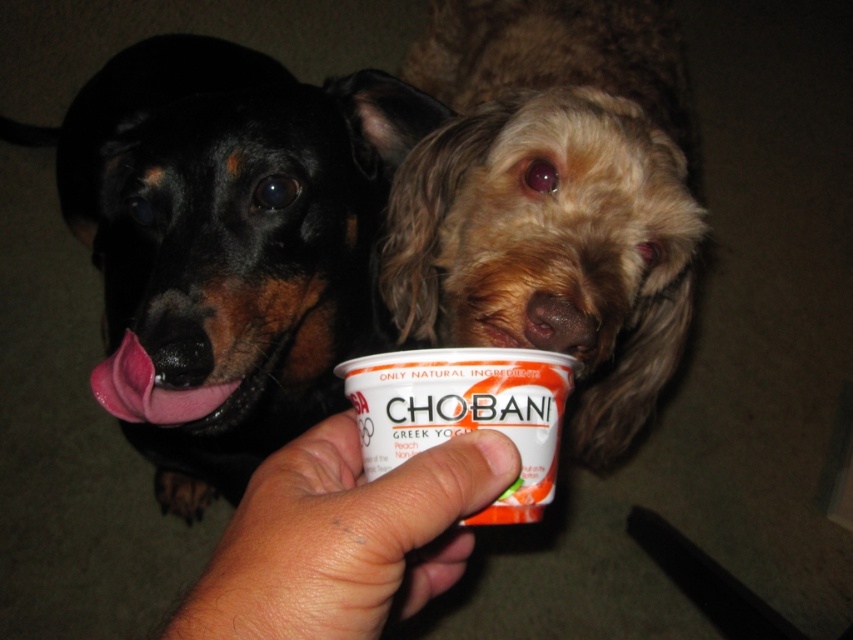
Does black glossy fur at left appear on the right side of shaggy brown fur at center?

Incorrect, black glossy fur at left is not on the right side of shaggy brown fur at center.

Is black glossy fur at left above shaggy brown fur at center?

Yes.

This screenshot has height=640, width=853. Describe the element at coordinates (227, 244) in the screenshot. I see `black glossy fur at left` at that location.

In order to click on black glossy fur at left in this screenshot , I will do `click(227, 244)`.

Is shaggy brown fur at center taller than smooth skin hand at center?

Yes.

Where is `shaggy brown fur at center`? shaggy brown fur at center is located at coordinates (552, 198).

Is black glossy fur at left wider than smooth skin hand at center?

Indeed, black glossy fur at left has a greater width compared to smooth skin hand at center.

Is black glossy fur at left smaller than smooth skin hand at center?

No.

Image resolution: width=853 pixels, height=640 pixels. What do you see at coordinates (227, 244) in the screenshot?
I see `black glossy fur at left` at bounding box center [227, 244].

Locate an element on the screen. This screenshot has width=853, height=640. black glossy fur at left is located at coordinates (227, 244).